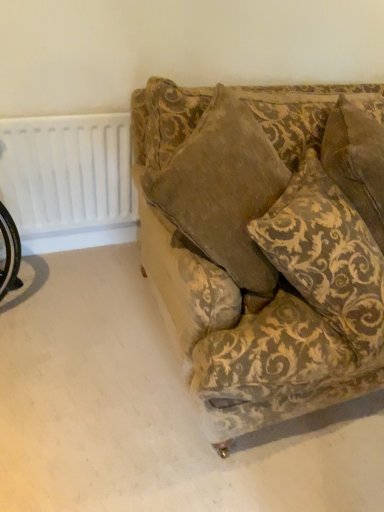
Question: Is gold-patterned fabric pillow at upper right to the right of velvet-patterned couch at center from the viewer's perspective?

Choices:
 (A) yes
 (B) no

Answer: (A)

Question: From a real-world perspective, is gold-patterned fabric pillow at upper right under velvet-patterned couch at center?

Choices:
 (A) yes
 (B) no

Answer: (B)

Question: Are gold-patterned fabric pillow at upper right and velvet-patterned couch at center far apart?

Choices:
 (A) no
 (B) yes

Answer: (A)

Question: Is velvet-patterned couch at center at the back of gold-patterned fabric pillow at upper right?

Choices:
 (A) no
 (B) yes

Answer: (B)

Question: Can you confirm if gold-patterned fabric pillow at upper right is thinner than velvet-patterned couch at center?

Choices:
 (A) no
 (B) yes

Answer: (B)

Question: Looking at the image, does gold-patterned fabric pillow at upper right seem bigger or smaller compared to white plastic radiator at upper left?

Choices:
 (A) small
 (B) big

Answer: (B)

Question: In the image, is gold-patterned fabric pillow at upper right positioned in front of or behind white plastic radiator at upper left?

Choices:
 (A) behind
 (B) front

Answer: (B)

Question: Considering the positions of gold-patterned fabric pillow at upper right and white plastic radiator at upper left in the image, is gold-patterned fabric pillow at upper right wider or thinner than white plastic radiator at upper left?

Choices:
 (A) wide
 (B) thin

Answer: (A)

Question: Is point (359, 224) positioned closer to the camera than point (102, 121)?

Choices:
 (A) closer
 (B) farther

Answer: (A)

Question: From their relative heights in the image, would you say white plastic radiator at upper left is taller or shorter than gold-patterned fabric pillow at upper right?

Choices:
 (A) short
 (B) tall

Answer: (A)

Question: In the image, is white plastic radiator at upper left on the left side or the right side of gold-patterned fabric pillow at upper right?

Choices:
 (A) right
 (B) left

Answer: (B)

Question: From the image's perspective, is white plastic radiator at upper left above or below gold-patterned fabric pillow at upper right?

Choices:
 (A) below
 (B) above

Answer: (B)

Question: From a real-world perspective, is white plastic radiator at upper left above or below gold-patterned fabric pillow at upper right?

Choices:
 (A) below
 (B) above

Answer: (A)

Question: Is white plastic radiator at upper left wider or thinner than velvet-patterned couch at center?

Choices:
 (A) thin
 (B) wide

Answer: (A)

Question: Do you think white plastic radiator at upper left is within velvet-patterned couch at center, or outside of it?

Choices:
 (A) inside
 (B) outside

Answer: (B)